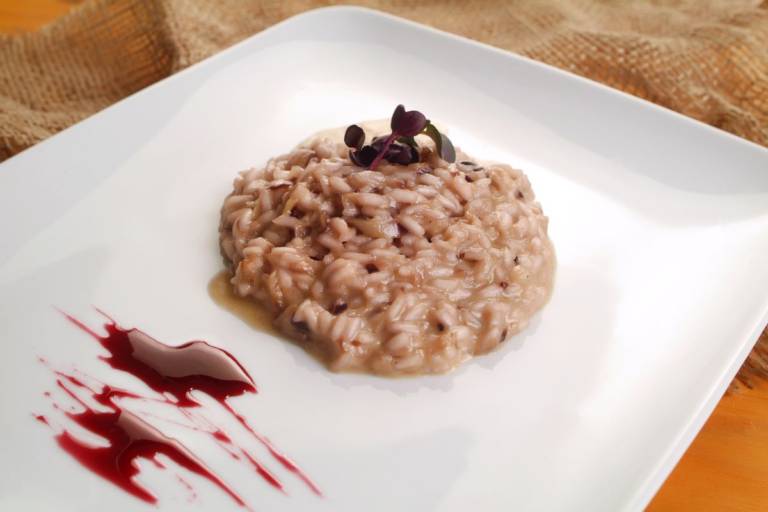
I want to click on light brown burlap, so click(x=657, y=61), click(x=84, y=75).